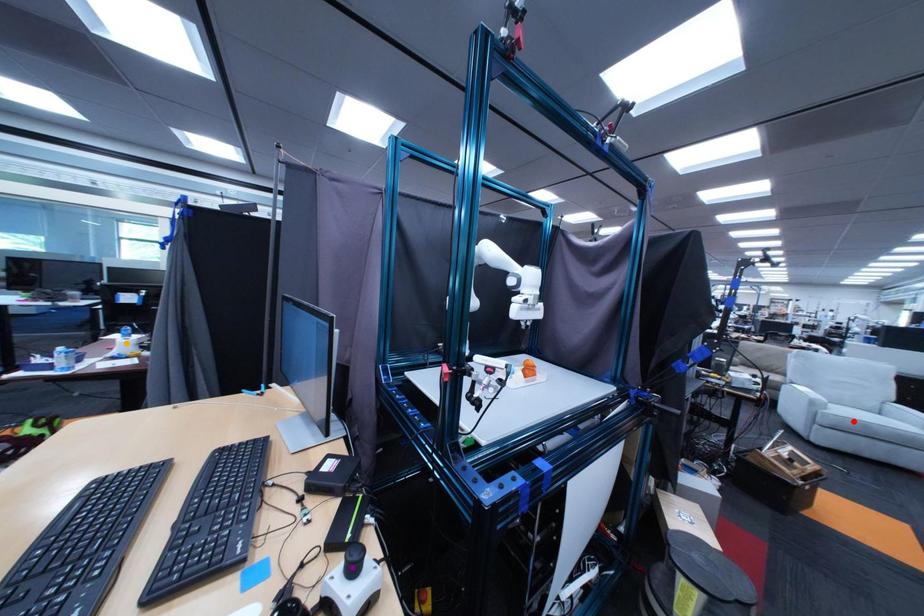
Order these from nearest to farthest:
1. orange point
2. purple point
3. red point

purple point → orange point → red point